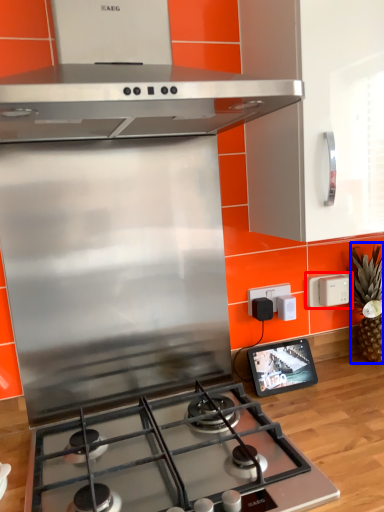
Question: Which of the following is the closest to the observer, electric outlet (highlighted by a red box) or pineapple (highlighted by a blue box)?

Choices:
 (A) electric outlet
 (B) pineapple

Answer: (B)